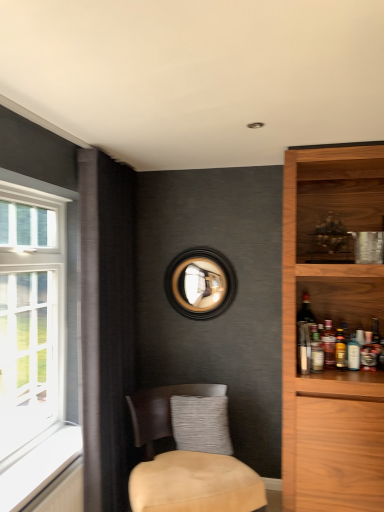
Question: Does translucent glass bottle at shelf right, acting as the 3th beverage starting from the right, have a larger size compared to translucent glass bottle at shelf right, the first beverage positioned from the right?

Choices:
 (A) no
 (B) yes

Answer: (B)

Question: Is translucent glass bottle at shelf right, acting as the 3th beverage starting from the right, to the right of translucent glass bottle at shelf right, the fourth beverage from the left, from the viewer's perspective?

Choices:
 (A) no
 (B) yes

Answer: (A)

Question: Is translucent glass bottle at shelf right, acting as the 3th beverage starting from the right, further to camera compared to translucent glass bottle at shelf right, the first beverage positioned from the right?

Choices:
 (A) yes
 (B) no

Answer: (A)

Question: Is translucent glass bottle at shelf right, acting as the 3th beverage starting from the right, outside translucent glass bottle at shelf right, the fourth beverage from the left?

Choices:
 (A) no
 (B) yes

Answer: (B)

Question: Can you confirm if translucent glass bottle at shelf right, acting as the 3th beverage starting from the right, is shorter than translucent glass bottle at shelf right, the first beverage positioned from the right?

Choices:
 (A) yes
 (B) no

Answer: (B)

Question: From the image's perspective, is black wood picture frame at center above or below white plastic bottle at shelf right, the 2th beverage when ordered from right to left?

Choices:
 (A) below
 (B) above

Answer: (B)

Question: Looking at their shapes, would you say black wood picture frame at center is wider or thinner than white plastic bottle at shelf right, the 2th beverage when ordered from right to left?

Choices:
 (A) thin
 (B) wide

Answer: (B)

Question: Is point (172, 272) positioned closer to the camera than point (347, 351)?

Choices:
 (A) farther
 (B) closer

Answer: (A)

Question: Is black wood picture frame at center to the left or to the right of white plastic bottle at shelf right, which is counted as the third beverage, starting from the left, in the image?

Choices:
 (A) left
 (B) right

Answer: (A)

Question: Considering their positions, is translucent glass bottle at shelf right, placed as the first beverage when sorted from left to right, located in front of or behind black wood picture frame at center?

Choices:
 (A) behind
 (B) front

Answer: (B)

Question: Choose the correct answer: Is translucent glass bottle at shelf right, the 4th beverage positioned from the right, inside black wood picture frame at center or outside it?

Choices:
 (A) inside
 (B) outside

Answer: (B)

Question: From the image's perspective, is translucent glass bottle at shelf right, placed as the first beverage when sorted from left to right, positioned above or below black wood picture frame at center?

Choices:
 (A) below
 (B) above

Answer: (A)

Question: From their relative heights in the image, would you say translucent glass bottle at shelf right, the 4th beverage positioned from the right, is taller or shorter than black wood picture frame at center?

Choices:
 (A) short
 (B) tall

Answer: (A)

Question: Is translucent glass bottle at shelf right, acting as the second beverage starting from the left, situated inside translucent glass bottle at shelf right, the fourth beverage from the left, or outside?

Choices:
 (A) outside
 (B) inside

Answer: (A)

Question: In terms of size, does translucent glass bottle at shelf right, acting as the second beverage starting from the left, appear bigger or smaller than translucent glass bottle at shelf right, the fourth beverage from the left?

Choices:
 (A) big
 (B) small

Answer: (A)